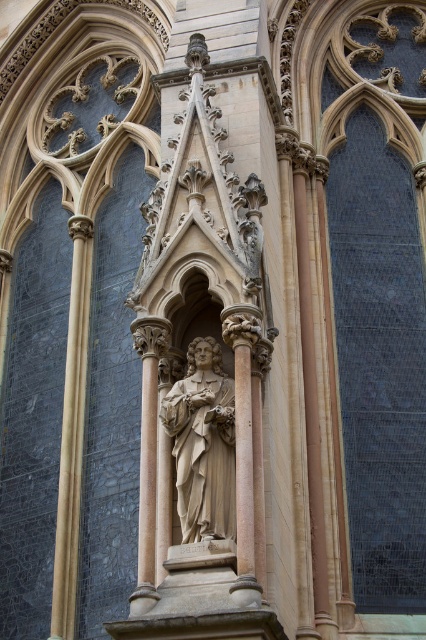
Who is shorter, polished stone statue at center or beige stone column at center?

Standing shorter between the two is polished stone statue at center.

Between point (213, 385) and point (149, 442), which one is positioned behind?

The point (213, 385) is behind.

The width and height of the screenshot is (426, 640). I want to click on polished stone statue at center, so click(x=203, y=444).

Can you confirm if polished stone column at left is taller than beige stone column at center?

Correct, polished stone column at left is much taller as beige stone column at center.

The image size is (426, 640). What do you see at coordinates (71, 433) in the screenshot? I see `polished stone column at left` at bounding box center [71, 433].

What do you see at coordinates (71, 433) in the screenshot? I see `polished stone column at left` at bounding box center [71, 433].

This screenshot has width=426, height=640. Identify the location of polished stone column at left. (71, 433).

Does polished stone statue at center appear on the right side of polished stone column at left?

Correct, you'll find polished stone statue at center to the right of polished stone column at left.

Between polished stone statue at center and polished stone column at left, which one is positioned lower?

polished stone column at left

Is point (187, 493) farther from camera compared to point (72, 369)?

No.

This screenshot has width=426, height=640. I want to click on polished stone statue at center, so click(203, 444).